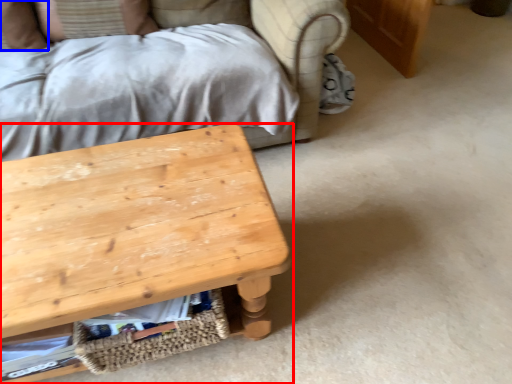
Question: Among these objects, which one is farthest to the camera, table (highlighted by a red box) or pillow (highlighted by a blue box)?

Choices:
 (A) table
 (B) pillow

Answer: (B)